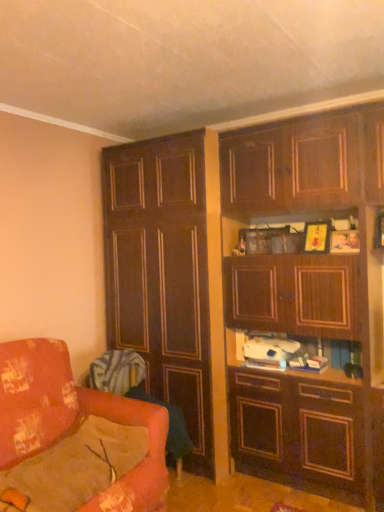
Question: Is velvet orange swivel chair at lower left, the 2th swivel chair in the bottom-to-top sequence, wider or thinner than floral fabric couch at lower left?

Choices:
 (A) thin
 (B) wide

Answer: (A)

Question: Considering their positions, is velvet orange swivel chair at lower left, the 2th swivel chair in the bottom-to-top sequence, located in front of or behind floral fabric couch at lower left?

Choices:
 (A) front
 (B) behind

Answer: (B)

Question: Based on their relative distances, which object is farther from the dark wood cabinet at left, the first cabinetry in the left-to-right sequence?

Choices:
 (A) floral fabric couch at lower left
 (B) wooden cabinet at upper right, which ranks as the second cabinetry in left-to-right order
 (C) velvet orange swivel chair at lower left, acting as the 1th swivel chair starting from the bottom
 (D) velvet orange swivel chair at lower left, the 2th swivel chair in the bottom-to-top sequence

Answer: (A)

Question: Which object is positioned closest to the velvet orange swivel chair at lower left, acting as the 1th swivel chair starting from the bottom?

Choices:
 (A) velvet orange swivel chair at lower left, arranged as the 1th swivel chair when viewed from the top
 (B) floral fabric couch at lower left
 (C) dark wood cabinet at left, the first cabinetry in the left-to-right sequence
 (D) wooden cabinet at upper right, which ranks as the second cabinetry in left-to-right order

Answer: (A)